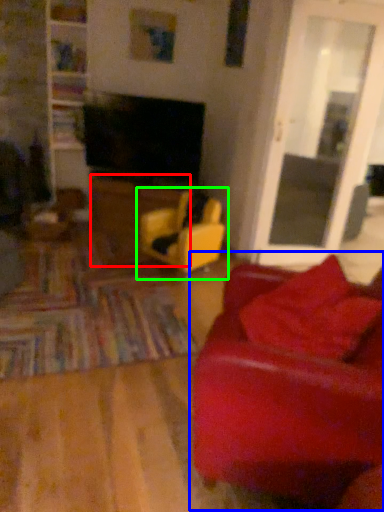
Question: Estimate the real-world distances between objects in this image. Which object is farther from table (highlighted by a red box), studio couch (highlighted by a blue box) or chair (highlighted by a green box)?

Choices:
 (A) studio couch
 (B) chair

Answer: (A)